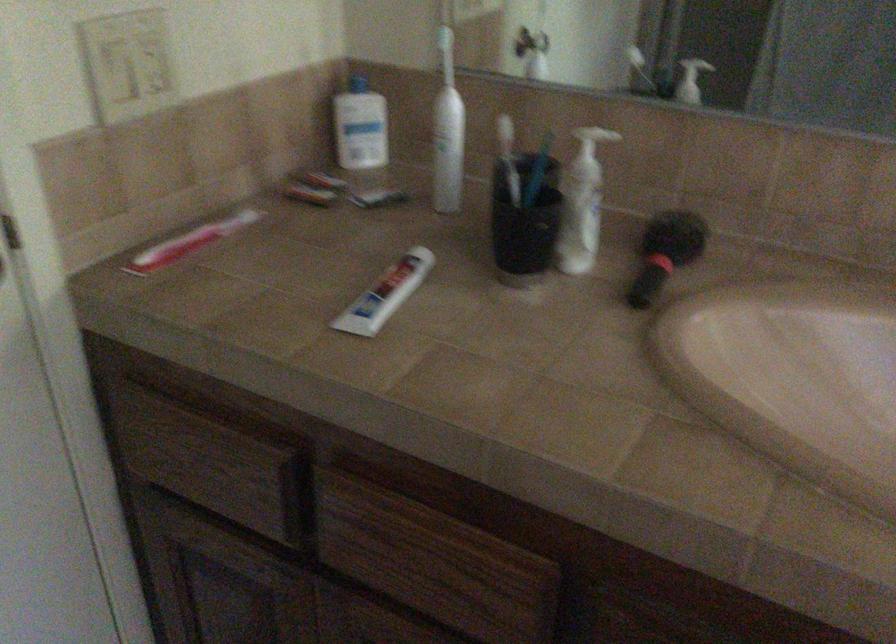
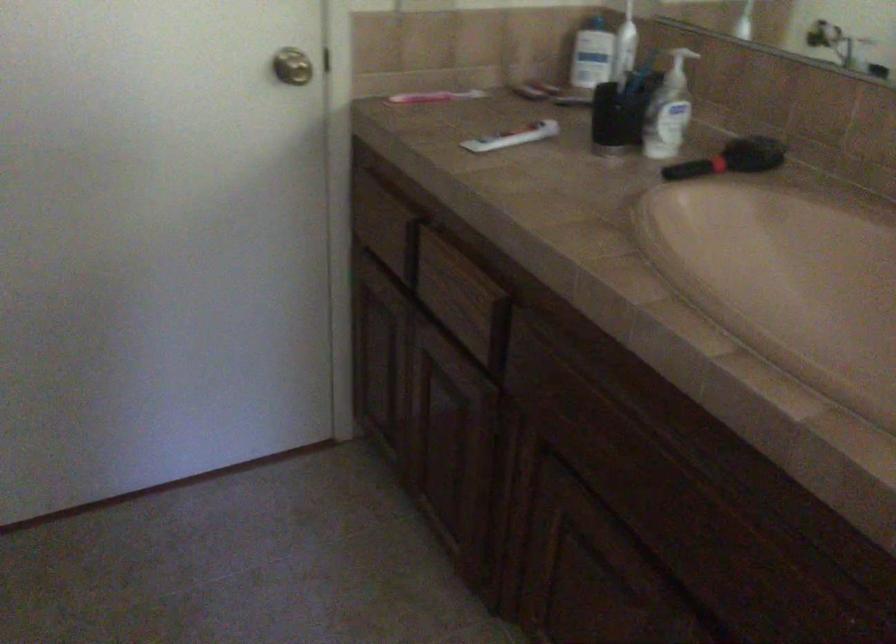
Question: The first image is from the beginning of the video and the second image is from the end. How did the camera likely rotate when shooting the video?

Choices:
 (A) Left
 (B) Right
 (C) Up
 (D) Down

Answer: (A)